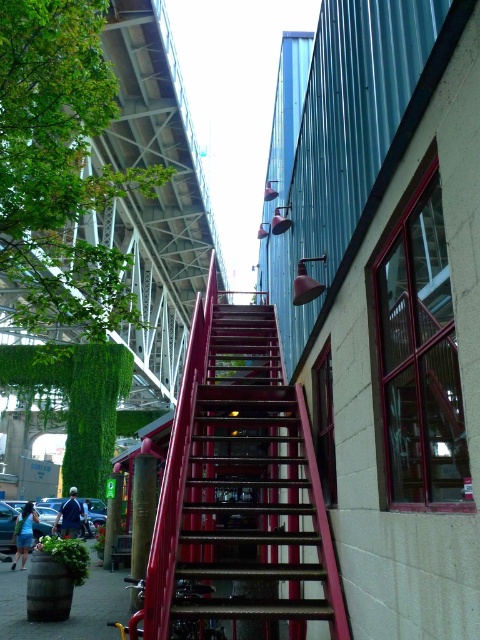
Between metallic red staircase at center and brown wooden barrel at lower left, which one appears on the right side from the viewer's perspective?

From the viewer's perspective, metallic red staircase at center appears more on the right side.

Is metallic red staircase at center positioned at the back of brown wooden barrel at lower left?

No, it is not.

Which is in front, point (277, 620) or point (17, 596)?

Point (277, 620) is in front.

The height and width of the screenshot is (640, 480). In order to click on metallic red staircase at center in this screenshot , I will do `click(240, 496)`.